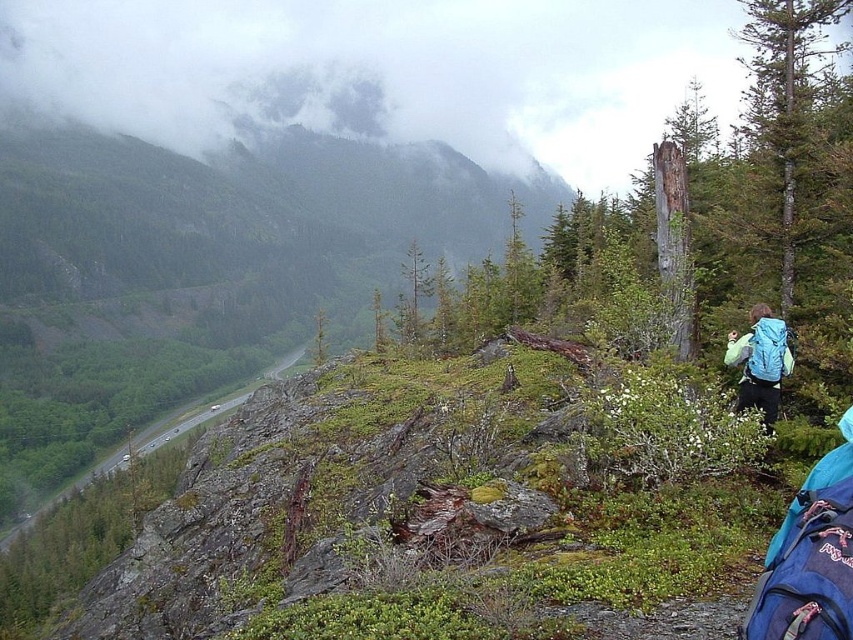
Does blue backpack at right lie in front of green grassy trail at lower left?

Yes, it is.

Can you confirm if blue backpack at right is positioned to the left of green grassy trail at lower left?

Incorrect, blue backpack at right is not on the left side of green grassy trail at lower left.

Does point (769, 385) come in front of point (181, 433)?

Yes.

Identify the location of blue backpack at right. (759, 362).